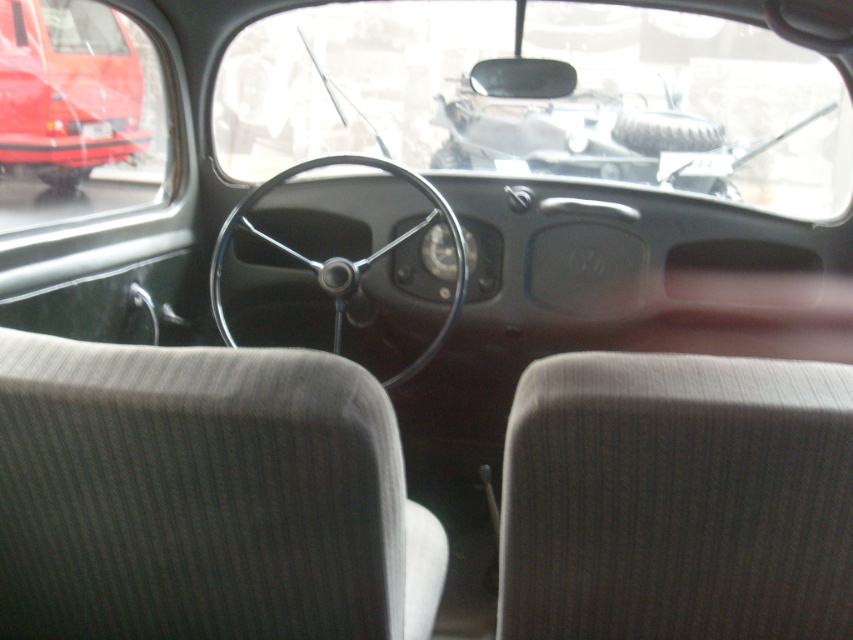
Does matte red car at left appear over black metallic steering wheel at center?

Yes.

Is matte red car at left further to the viewer compared to black metallic steering wheel at center?

That is True.

The height and width of the screenshot is (640, 853). Describe the element at coordinates (67, 90) in the screenshot. I see `matte red car at left` at that location.

Where is `matte red car at left`? Image resolution: width=853 pixels, height=640 pixels. matte red car at left is located at coordinates (67, 90).

Who is positioned more to the left, metallic gray engine at center or matte red car at left?

matte red car at left

Based on the photo, does metallic gray engine at center have a lesser width compared to matte red car at left?

Incorrect, metallic gray engine at center's width is not less than matte red car at left's.

Which is in front, point (471, 138) or point (35, 132)?

Point (471, 138) is in front.

You are a GUI agent. You are given a task and a screenshot of the screen. Output one action in this format:
    pyautogui.click(x=<x>, y=<y>)
    Task: Click on the metallic gray engine at center
    Image resolution: width=853 pixels, height=640 pixels.
    Given the screenshot: What is the action you would take?
    pyautogui.click(x=570, y=128)

Does metallic gray engine at center have a smaller size compared to black metallic steering wheel at center?

No, metallic gray engine at center is not smaller than black metallic steering wheel at center.

Is metallic gray engine at center above black metallic steering wheel at center?

Yes.

The height and width of the screenshot is (640, 853). Describe the element at coordinates (570, 128) in the screenshot. I see `metallic gray engine at center` at that location.

In order to click on metallic gray engine at center in this screenshot , I will do `click(570, 128)`.